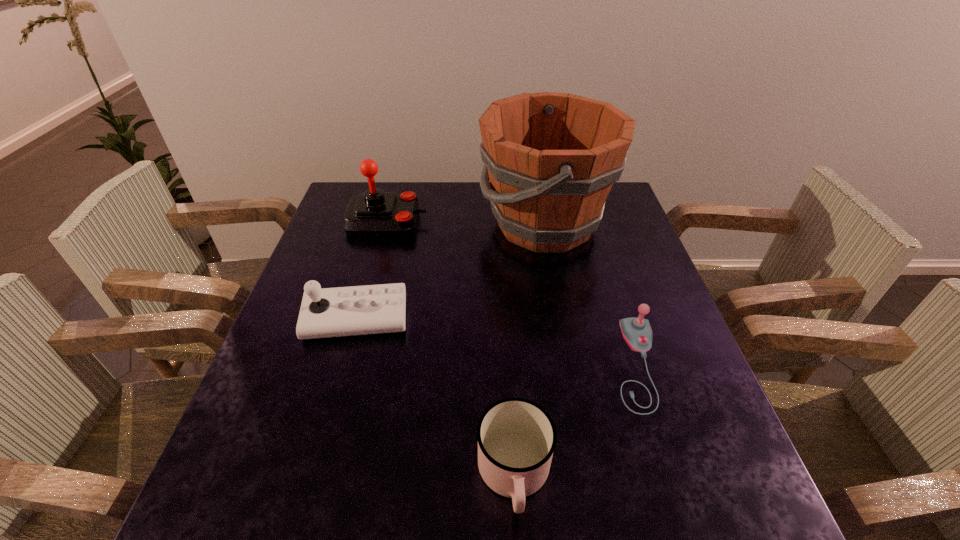
The image size is (960, 540). I want to click on free space that satisfies the following two spatial constraints: 1. on the handle side of the tallest object; 2. on the right side of the rightmost joystick, so click(x=571, y=364).

Find the location of a particular element. free point that satisfies the following two spatial constraints: 1. on the handle side of the tallest object; 2. on the left side of the rightmost joystick is located at coordinates (571, 364).

At what (x,y) coordinates should I click in order to perform the action: click on free point that satisfies the following two spatial constraints: 1. on the handle side of the bucket; 2. on the back side of the shortest joystick. Please return your answer as a coordinate pair (x, y). The image size is (960, 540). Looking at the image, I should click on (571, 364).